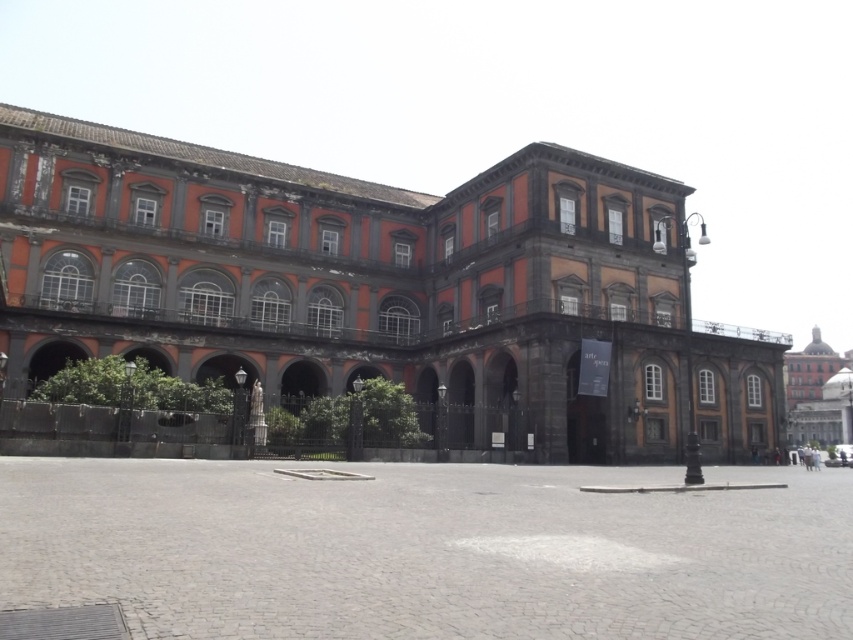
Is point (190, 186) positioned in front of point (801, 412)?

Yes, point (190, 186) is in front of point (801, 412).

Does point (444, 236) come farther from viewer compared to point (804, 385)?

No.

Which is in front, point (132, 316) or point (820, 358)?

Point (132, 316) is more forward.

This screenshot has width=853, height=640. In order to click on red brick building at center in this screenshot , I will do 380,285.